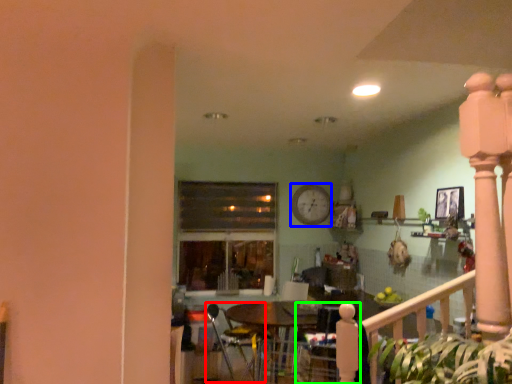
Question: Considering the real-world distances, which object is farthest from armchair (highlighted by a red box)? clock (highlighted by a blue box) or armchair (highlighted by a green box)?

Choices:
 (A) clock
 (B) armchair

Answer: (A)